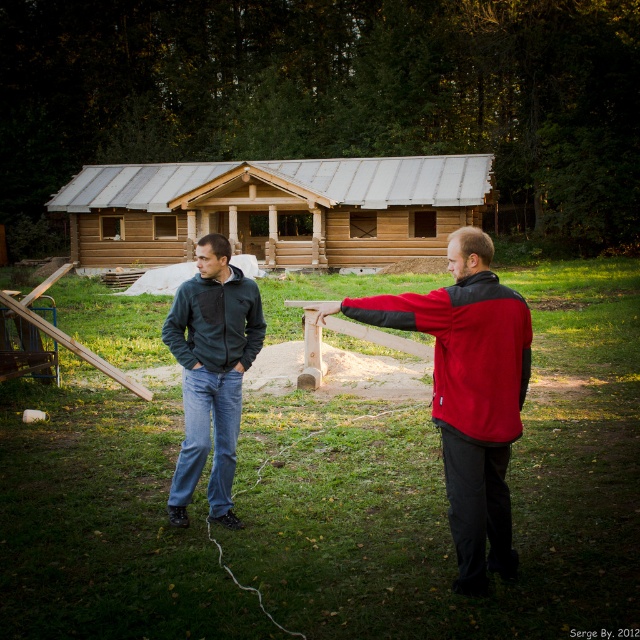
This screenshot has height=640, width=640. What do you see at coordinates (275, 209) in the screenshot? I see `wooden log cabin at center` at bounding box center [275, 209].

Does wooden log cabin at center lie in front of red fleece jacket at center?

No, it is not.

Who is more distant from viewer, [400,163] or [515,323]?

Positioned behind is point [400,163].

Where is `wooden log cabin at center`? wooden log cabin at center is located at coordinates pos(275,209).

Between green grass at center and matte green jacket at center, which one is positioned higher?

matte green jacket at center is above.

Which of these two, green grass at center or matte green jacket at center, stands taller?

matte green jacket at center

What do you see at coordinates (444, 492) in the screenshot?
I see `green grass at center` at bounding box center [444, 492].

Find the location of a particular element. This screenshot has width=640, height=640. green grass at center is located at coordinates (444, 492).

Does wooden log cabin at center appear under matte green jacket at center?

No, wooden log cabin at center is not below matte green jacket at center.

Find the location of a particular element. wooden log cabin at center is located at coordinates (275, 209).

Which is behind, point (76, 232) or point (228, 403)?

The point (76, 232) is behind.

Find the location of a particular element. wooden log cabin at center is located at coordinates (275, 209).